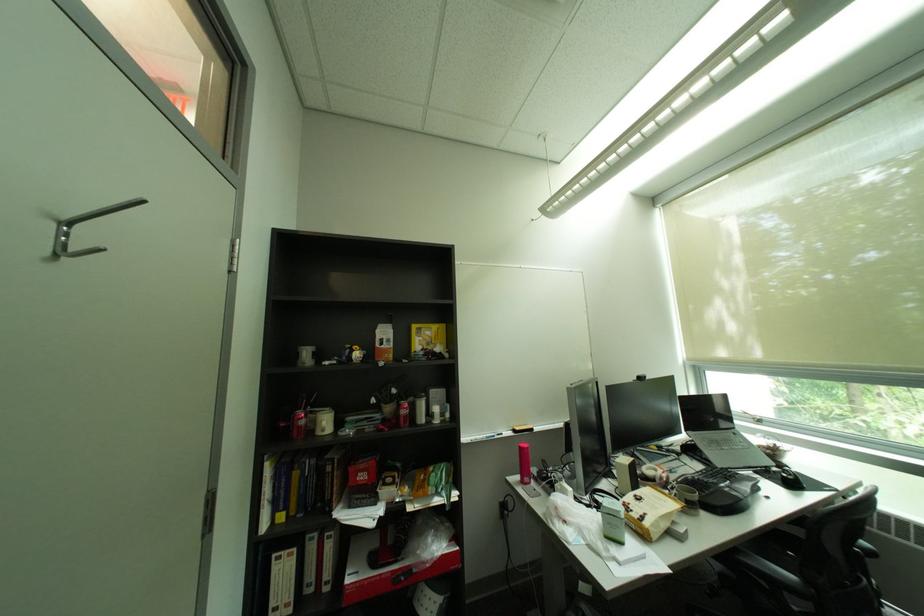
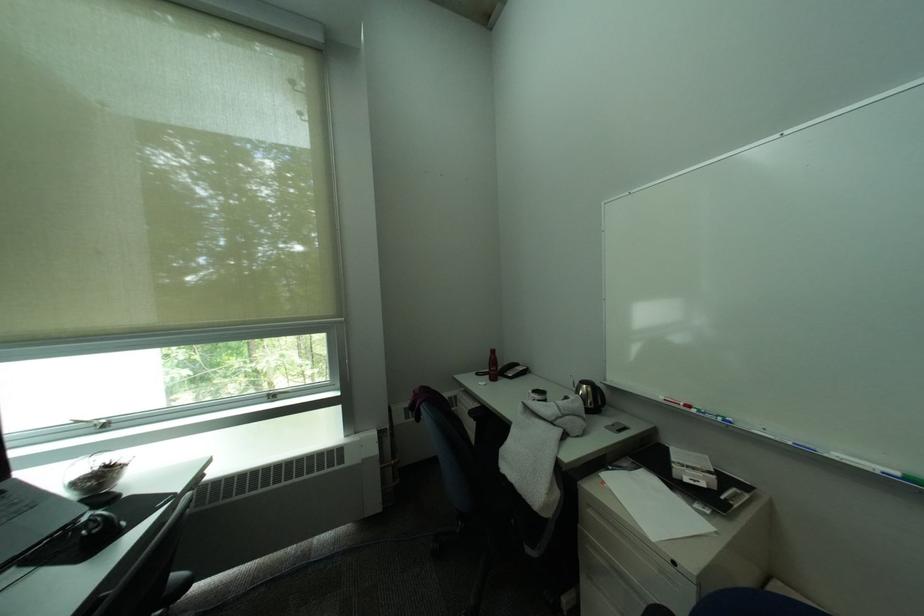
Find the pixel in the second image that matches point 801,477 in the first image.

(106, 528)